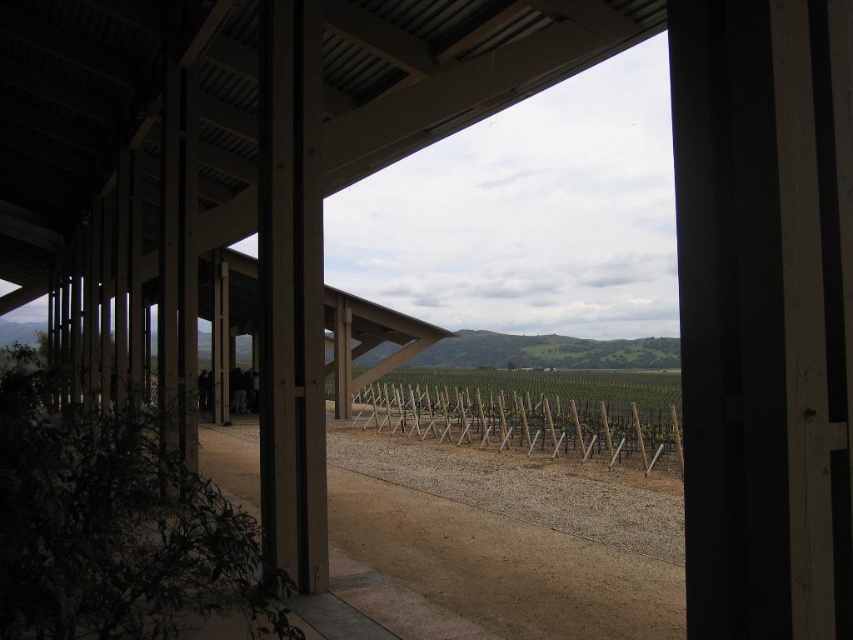
You are standing inside the wooden structure and want to exit through the open roof area. There is a smooth wood pillar at center and a green wooden fence at center in your way. Which object is closer to you, the observer?

The smooth wood pillar at center is closer to you than the green wooden fence at center because it is in front of it.

You are standing inside the wooden structure and want to see the view beyond the smooth wood pillar at center and the green wooden fence at center. Which object is blocking your view more towards the top?

The smooth wood pillar at center is above the green wooden fence at center, so it is blocking your view more towards the top.